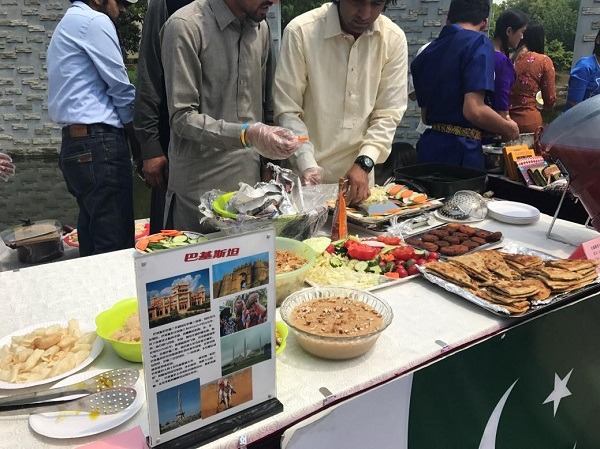
In order to click on pan of quesadillas in this screenshot , I will do `click(517, 280)`.